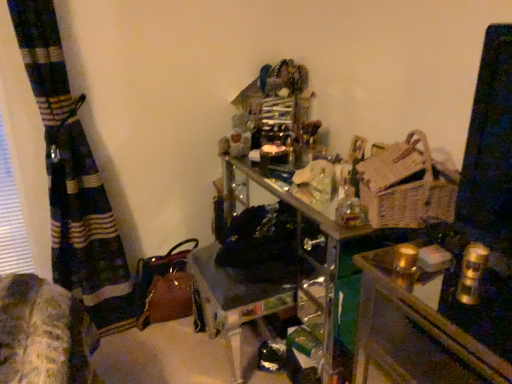
Question: From the image's perspective, is metallic gold candlesticks at center located beneath woven wicker basket at right?

Choices:
 (A) no
 (B) yes

Answer: (B)

Question: Considering the relative positions of metallic gold candlesticks at center and woven wicker basket at right in the image provided, is metallic gold candlesticks at center behind woven wicker basket at right?

Choices:
 (A) yes
 (B) no

Answer: (B)

Question: Is metallic gold candlesticks at center in contact with woven wicker basket at right?

Choices:
 (A) no
 (B) yes

Answer: (A)

Question: Does metallic gold candlesticks at center have a larger size compared to woven wicker basket at right?

Choices:
 (A) no
 (B) yes

Answer: (B)

Question: Is woven wicker basket at right at the back of metallic gold candlesticks at center?

Choices:
 (A) no
 (B) yes

Answer: (A)

Question: Is metallic gold candlesticks at center closer to the viewer compared to woven wicker basket at right?

Choices:
 (A) no
 (B) yes

Answer: (B)

Question: From a real-world perspective, is woven wicker basket at right positioned over metallic gold candlesticks at center based on gravity?

Choices:
 (A) yes
 (B) no

Answer: (A)

Question: Is woven wicker basket at right behind metallic gold candlesticks at center?

Choices:
 (A) no
 (B) yes

Answer: (B)

Question: Does woven wicker basket at right turn towards metallic gold candlesticks at center?

Choices:
 (A) yes
 (B) no

Answer: (B)

Question: Considering the relative positions of woven wicker basket at right and metallic gold candlesticks at center in the image provided, is woven wicker basket at right to the left of metallic gold candlesticks at center from the viewer's perspective?

Choices:
 (A) no
 (B) yes

Answer: (B)

Question: Is metallic gold candlesticks at center a part of woven wicker basket at right?

Choices:
 (A) no
 (B) yes

Answer: (A)

Question: Is woven wicker basket at right at the right side of metallic gold candlesticks at center?

Choices:
 (A) yes
 (B) no

Answer: (B)

Question: Looking at their shapes, would you say woven wicker basket at right is wider or thinner than metallic gold candlesticks at center?

Choices:
 (A) thin
 (B) wide

Answer: (A)